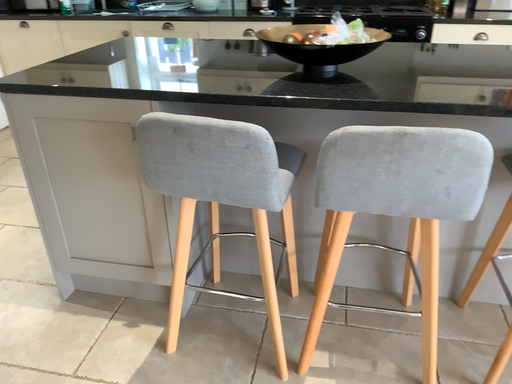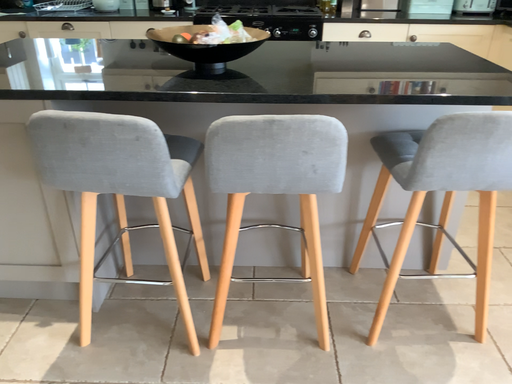
Question: How did the camera likely rotate when shooting the video?

Choices:
 (A) rotated left
 (B) rotated right

Answer: (B)